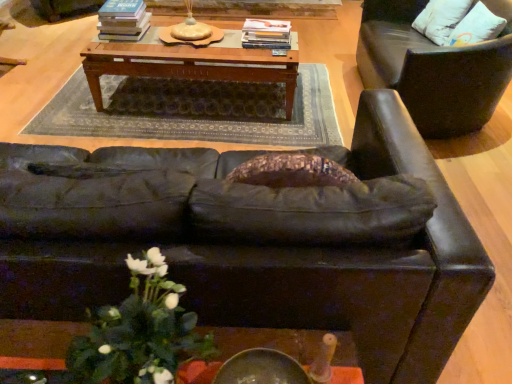
Question: Considering the relative sizes of hardcover books at center, the 1th book from the left, and wooden table at center in the image provided, is hardcover books at center, the 1th book from the left, thinner than wooden table at center?

Choices:
 (A) no
 (B) yes

Answer: (B)

Question: Would you say hardcover books at center, the 1th book from the left, is a long distance from wooden table at center?

Choices:
 (A) yes
 (B) no

Answer: (B)

Question: From a real-world perspective, does hardcover books at center, the second book from the right, sit lower than wooden table at center?

Choices:
 (A) no
 (B) yes

Answer: (A)

Question: Can you confirm if hardcover books at center, the second book from the right, is shorter than wooden table at center?

Choices:
 (A) no
 (B) yes

Answer: (B)

Question: Does hardcover books at center, the second book from the right, touch wooden table at center?

Choices:
 (A) yes
 (B) no

Answer: (B)

Question: Does hardcover books at center, the 1th book from the left, have a smaller size compared to wooden table at center?

Choices:
 (A) yes
 (B) no

Answer: (A)

Question: Is white matte floral arrangement at lower left turned away from hardcover books at center, the second book from the right?

Choices:
 (A) yes
 (B) no

Answer: (A)

Question: Is white matte floral arrangement at lower left positioned far away from hardcover books at center, the second book from the right?

Choices:
 (A) no
 (B) yes

Answer: (B)

Question: From a real-world perspective, does white matte floral arrangement at lower left sit lower than hardcover books at center, the second book from the right?

Choices:
 (A) no
 (B) yes

Answer: (A)

Question: Does white matte floral arrangement at lower left have a lesser width compared to hardcover books at center, the second book from the right?

Choices:
 (A) yes
 (B) no

Answer: (A)

Question: Considering the relative positions of white matte floral arrangement at lower left and hardcover books at center, the 1th book from the left, in the image provided, is white matte floral arrangement at lower left in front of hardcover books at center, the 1th book from the left,?

Choices:
 (A) yes
 (B) no

Answer: (A)

Question: From the image's perspective, does white matte floral arrangement at lower left appear lower than hardcover books at center, the second book from the right?

Choices:
 (A) yes
 (B) no

Answer: (A)

Question: Is leather chair at right surrounding white matte floral arrangement at lower left?

Choices:
 (A) yes
 (B) no

Answer: (B)